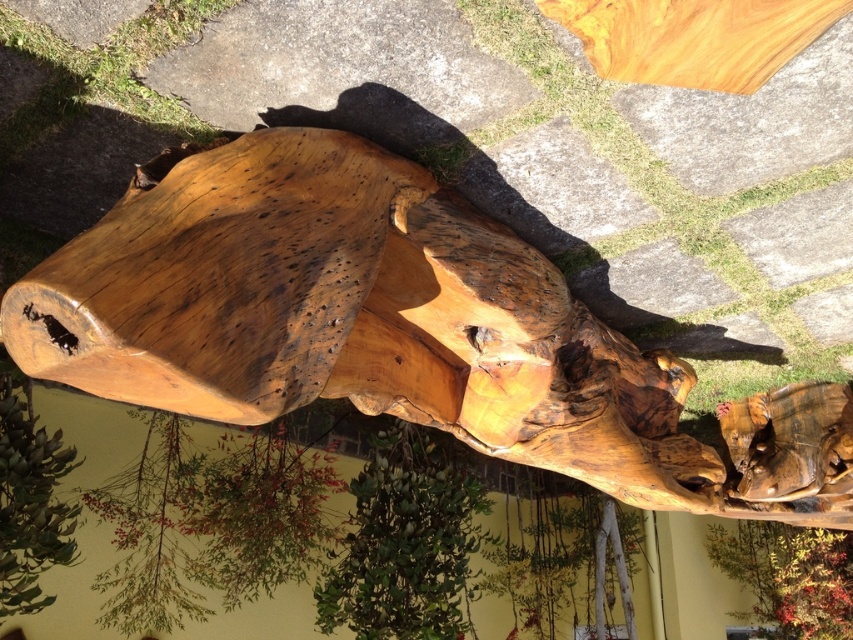
Question: Which object appears closest to the camera in this image?

Choices:
 (A) natural wood tree trunk at center
 (B) green matte tree at center

Answer: (B)

Question: Can you confirm if green matte tree at center is wider than natural wood tree trunk at center?

Choices:
 (A) no
 (B) yes

Answer: (A)

Question: Where is natural wood bench at center located in relation to natural wood tree trunk at center in the image?

Choices:
 (A) above
 (B) below

Answer: (A)

Question: Which of the following is the closest to the observer?

Choices:
 (A) (793, 605)
 (B) (666, 456)
 (C) (9, 570)

Answer: (B)

Question: Which point is closer to the camera?

Choices:
 (A) (390, 560)
 (B) (38, 456)
 (C) (306, 176)
 (D) (804, 614)

Answer: (C)

Question: Does natural wood tree trunk at center have a smaller size compared to natural wood tree trunk at lower left?

Choices:
 (A) no
 (B) yes

Answer: (A)